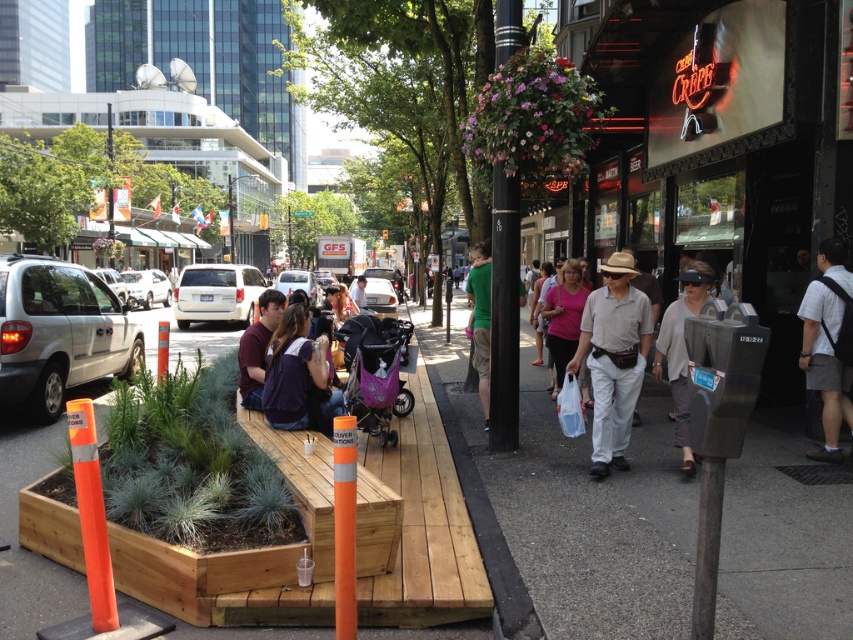
Question: Which object appears farthest from the camera in this image?

Choices:
 (A) matte pink shirt at center
 (B) wooden bench at center
 (C) light brown cotton shirt at center

Answer: (A)

Question: Is gray concrete sidewalk at center closer to camera compared to white cotton shirt at right?

Choices:
 (A) no
 (B) yes

Answer: (B)

Question: Does pink floral hanging basket at upper center have a larger size compared to green matte shirt at center?

Choices:
 (A) no
 (B) yes

Answer: (B)

Question: Which of these objects is positioned farthest from the gray concrete sidewalk at center?

Choices:
 (A) green matte shirt at center
 (B) pink floral hanging basket at upper center

Answer: (A)

Question: Is gray concrete sidewalk at center bigger than pink floral hanging basket at upper center?

Choices:
 (A) yes
 (B) no

Answer: (A)

Question: Based on their relative distances, which object is nearer to the gray concrete sidewalk at center?

Choices:
 (A) matte pink shirt at center
 (B) matte maroon shirt at center
 (C) green matte shirt at center

Answer: (A)